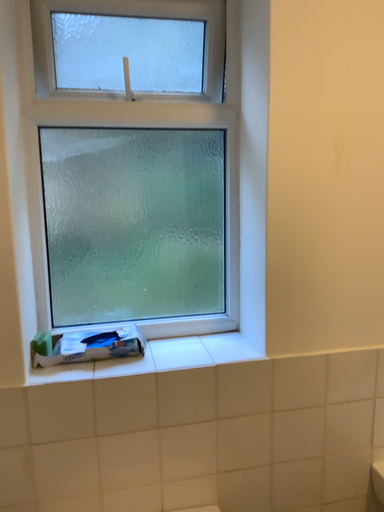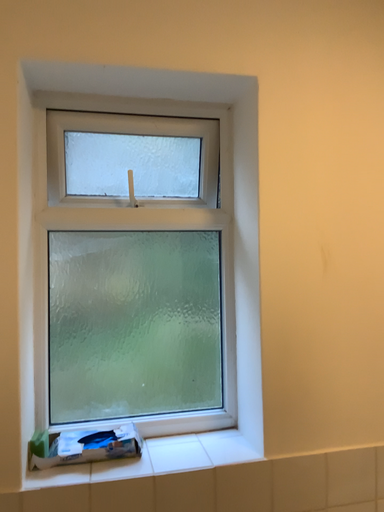
Question: How did the camera likely rotate when shooting the video?

Choices:
 (A) rotated upward
 (B) rotated downward

Answer: (A)